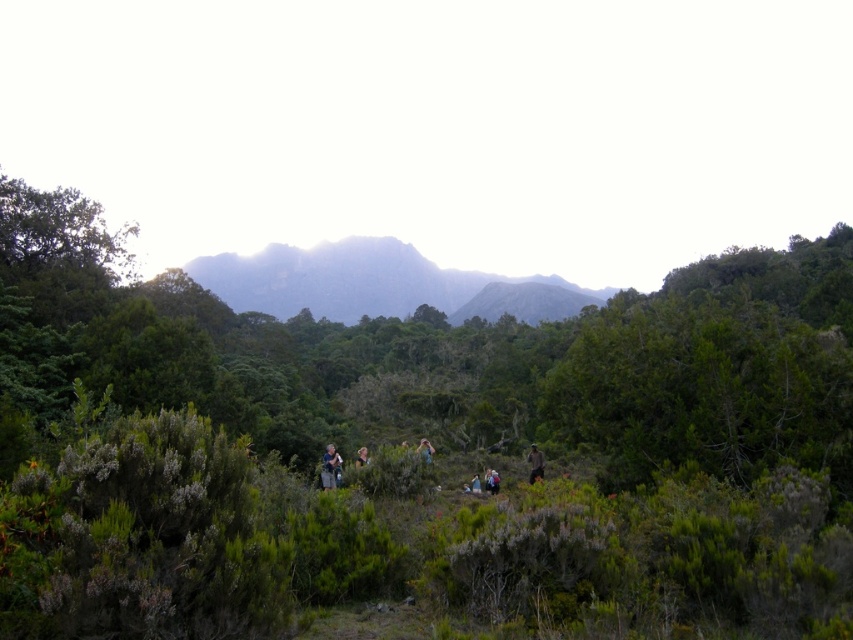
Question: Does gray-green textured mountain at center have a larger size compared to light brown hair at center?

Choices:
 (A) yes
 (B) no

Answer: (A)

Question: Which point appears closest to the camera in this image?

Choices:
 (A) (x=389, y=262)
 (B) (x=26, y=236)

Answer: (B)

Question: Can you confirm if gray-green textured mountain at center is wider than blue denim jacket at center?

Choices:
 (A) no
 (B) yes

Answer: (B)

Question: Which object is positioned farthest from the light brown fabric jacket at lower center?

Choices:
 (A) blue denim jeans at center
 (B) gray-green textured mountain at center
 (C) brown fabric person at center
 (D) blue fabric backpack at center

Answer: (B)

Question: Is green leafy tree at upper left further to camera compared to light brown hair at center?

Choices:
 (A) no
 (B) yes

Answer: (B)

Question: Which object is positioned farthest from the gray-green textured mountain at center?

Choices:
 (A) blue fabric backpack at center
 (B) light brown fabric jacket at lower center
 (C) green leafy tree at upper left

Answer: (B)